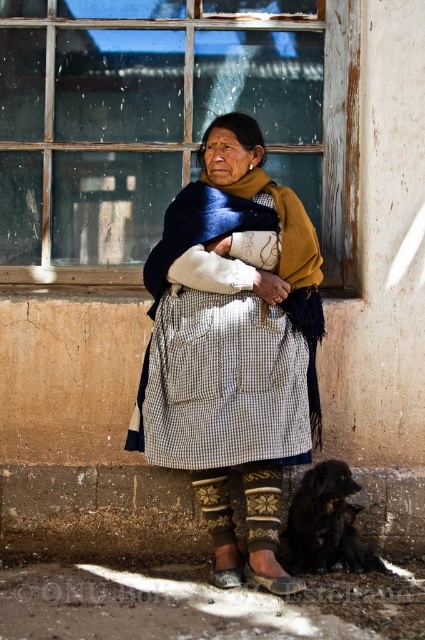
Question: Which of the following is the closest to the observer?

Choices:
 (A) (348, 513)
 (B) (275, 579)
 (C) (96, 214)
 (D) (161, 342)

Answer: (B)

Question: Can you confirm if checkered fabric skirt at center is positioned below black fur dog at lower right?

Choices:
 (A) no
 (B) yes

Answer: (A)

Question: Is clear glass window at upper center to the left of black fur dog at lower right from the viewer's perspective?

Choices:
 (A) yes
 (B) no

Answer: (A)

Question: Can you confirm if black fur dog at lower right is thinner than brown leather sandal at lower center?

Choices:
 (A) yes
 (B) no

Answer: (B)

Question: Which of the following is the closest to the observer?

Choices:
 (A) clear glass window at upper center
 (B) checkered fabric skirt at center

Answer: (B)

Question: Which point is farther from the camera taking this photo?

Choices:
 (A) (269, 586)
 (B) (322, 500)

Answer: (B)